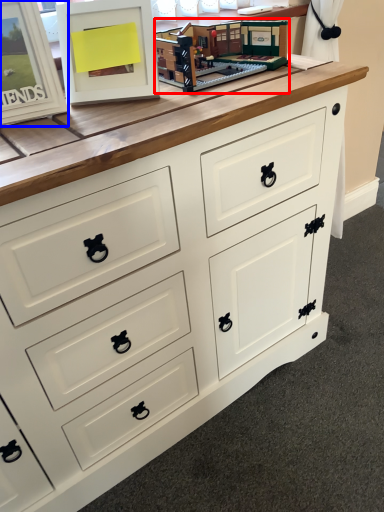
Question: Which object appears farthest to the camera in this image, toy (highlighted by a red box) or picture frame (highlighted by a blue box)?

Choices:
 (A) toy
 (B) picture frame

Answer: (A)